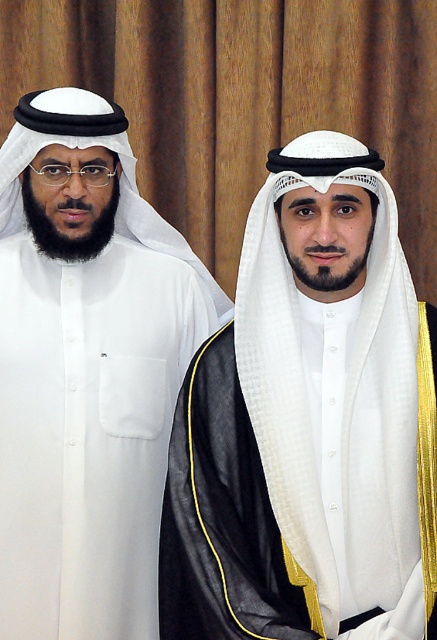
Question: Among these points, which one is farthest from the camera?

Choices:
 (A) (106, 456)
 (B) (381, 257)

Answer: (A)

Question: Which point is closer to the camera taking this photo?

Choices:
 (A) (308, 397)
 (B) (131, 429)

Answer: (A)

Question: Can you confirm if white matte headscarf at center is bigger than white matte kandura at left?

Choices:
 (A) no
 (B) yes

Answer: (A)

Question: Does white matte headscarf at center lie in front of white matte kandura at left?

Choices:
 (A) yes
 (B) no

Answer: (A)

Question: Can you confirm if white matte headscarf at center is smaller than white matte kandura at left?

Choices:
 (A) no
 (B) yes

Answer: (B)